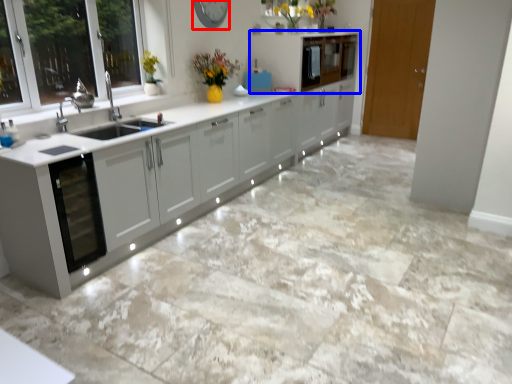
Question: Which object is further to the camera taking this photo, clock (highlighted by a red box) or cabinetry (highlighted by a blue box)?

Choices:
 (A) clock
 (B) cabinetry

Answer: (B)